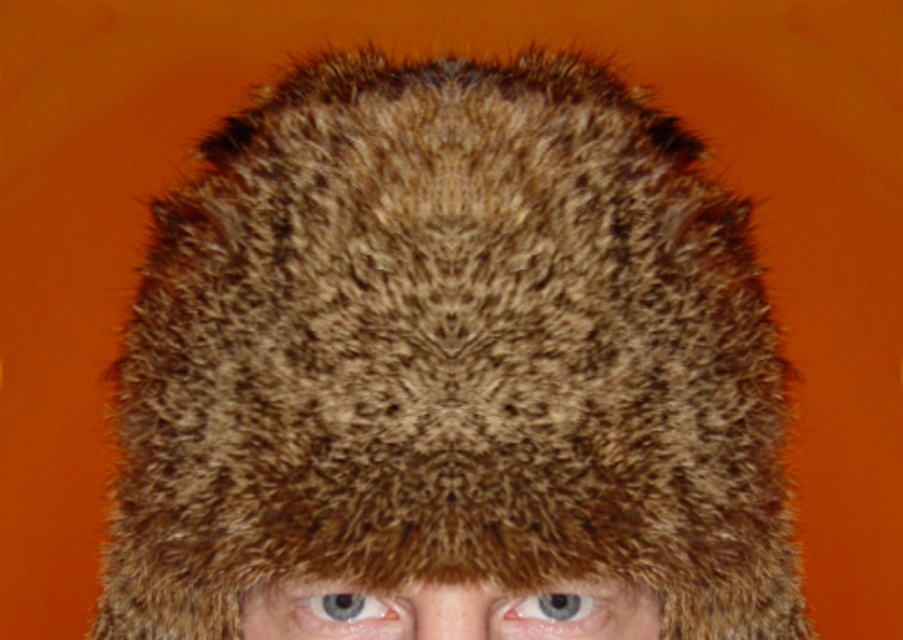
Question: Which object is closer to the camera taking this photo?

Choices:
 (A) blue glossy eye at center
 (B) blue iridescent eye at center

Answer: (A)

Question: In this image, where is blue glossy eye at center located relative to blue iridescent eye at center?

Choices:
 (A) below
 (B) above

Answer: (B)

Question: In this image, where is blue glossy eye at center located relative to blue iridescent eye at center?

Choices:
 (A) right
 (B) left

Answer: (A)

Question: Does blue glossy eye at center appear over blue iridescent eye at center?

Choices:
 (A) no
 (B) yes

Answer: (B)

Question: Which point is closer to the camera?

Choices:
 (A) (350, 604)
 (B) (534, 620)

Answer: (A)